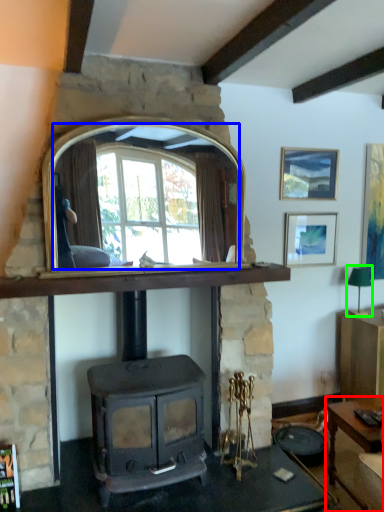
Question: Based on their relative distances, which object is farther from desk (highlighted by a red box)? Choose from mirror (highlighted by a blue box) and lamp (highlighted by a green box).

Choices:
 (A) mirror
 (B) lamp

Answer: (A)